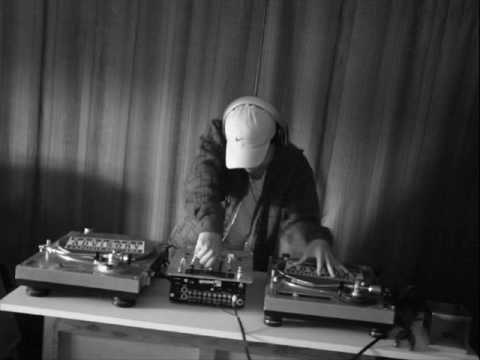
What are the coordinates of `electric cords` in the screenshot? It's located at (245, 334), (360, 349).